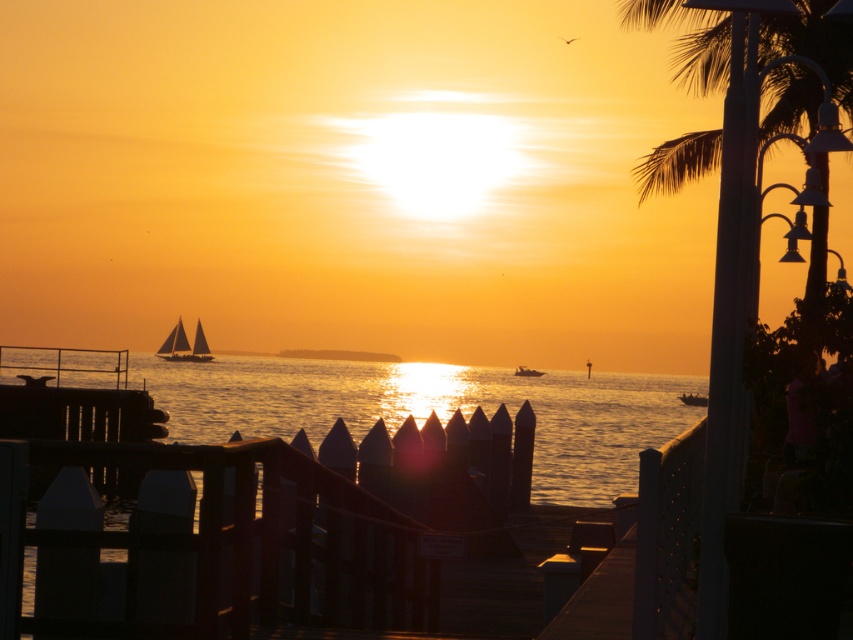
Question: Which point is farther from the camera taking this photo?

Choices:
 (A) (169, 358)
 (B) (602, 381)
 (C) (822, 237)

Answer: (A)

Question: Estimate the real-world distances between objects in this image. Which object is farther from the glistening water at center?

Choices:
 (A) green leafy palm tree at upper right
 (B) metallic silver boat at center

Answer: (A)

Question: Is smooth wooden boat at center closer to camera compared to metallic silver boat at center?

Choices:
 (A) no
 (B) yes

Answer: (B)

Question: Which object is positioned closest to the green leafy palm tree at upper right?

Choices:
 (A) glistening water at center
 (B) matte black sailboat at left
 (C) metallic silver boat at center
 (D) smooth wooden boat at center

Answer: (A)

Question: Is green leafy palm tree at upper right wider than matte black sailboat at left?

Choices:
 (A) yes
 (B) no

Answer: (B)

Question: Observing the image, what is the correct spatial positioning of matte black sailboat at left in reference to metallic silver boat at center?

Choices:
 (A) left
 (B) right

Answer: (A)